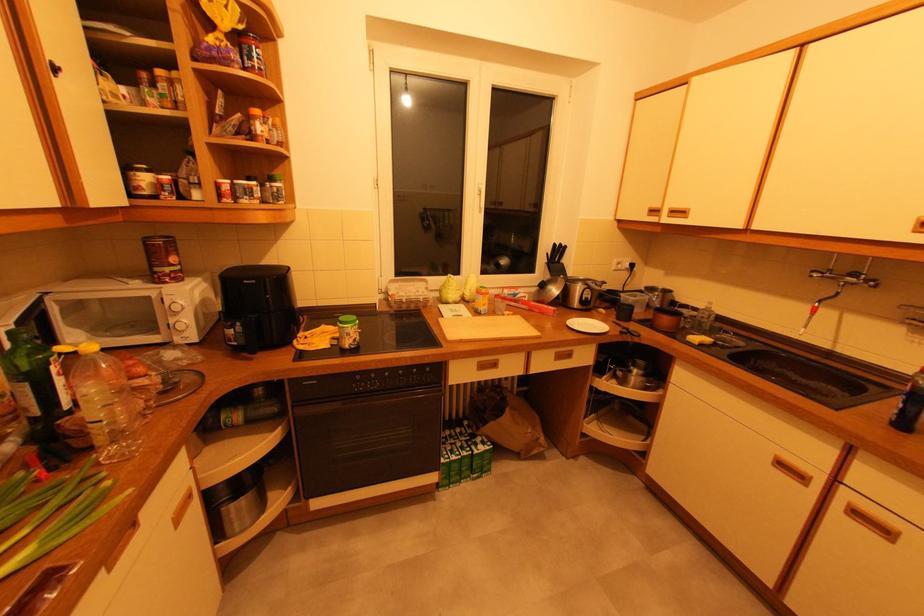
What do you see at coordinates (105, 403) in the screenshot? This screenshot has width=924, height=616. I see `the clear plastic bottle` at bounding box center [105, 403].